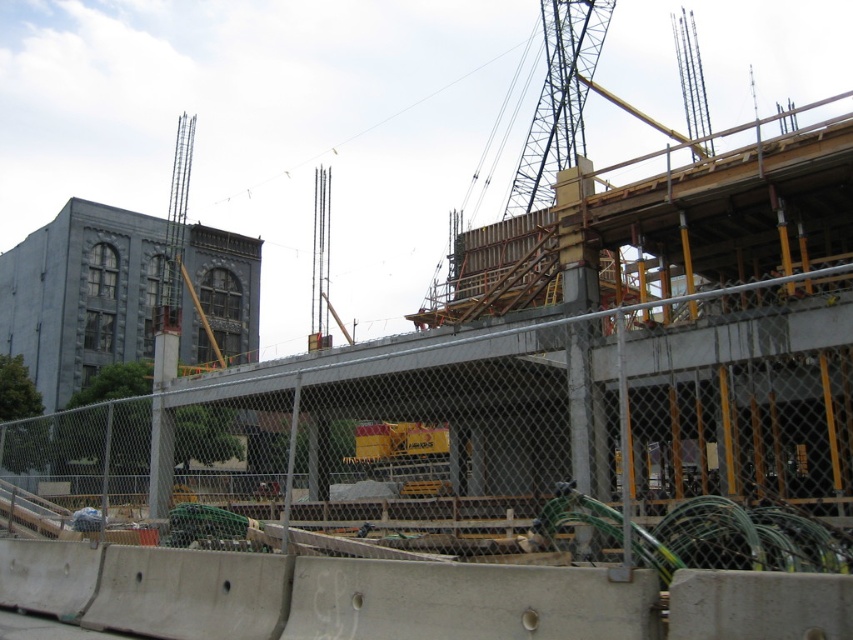
Question: Is metal mesh fence at center smaller than metallic gray crane at upper right?

Choices:
 (A) yes
 (B) no

Answer: (B)

Question: Is metal mesh fence at center positioned behind metallic gray crane at upper right?

Choices:
 (A) no
 (B) yes

Answer: (A)

Question: Among these points, which one is farthest from the camera?

Choices:
 (A) (558, 49)
 (B) (849, 412)

Answer: (A)

Question: Does metal mesh fence at center appear on the left side of metallic gray crane at upper right?

Choices:
 (A) yes
 (B) no

Answer: (A)

Question: Among these objects, which one is farthest from the camera?

Choices:
 (A) metallic gray crane at upper right
 (B) metal mesh fence at center

Answer: (A)